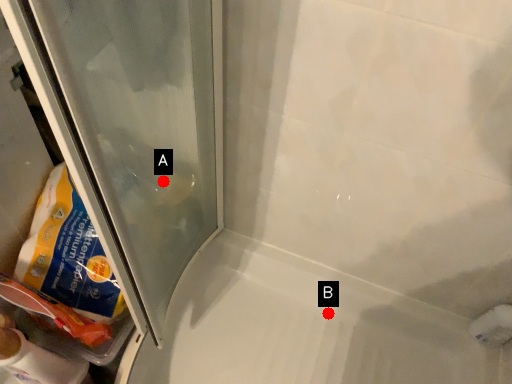
Question: Two points are circled on the image, labeled by A and B beside each circle. Which point is farther to the camera?

Choices:
 (A) A is further
 (B) B is further

Answer: (B)